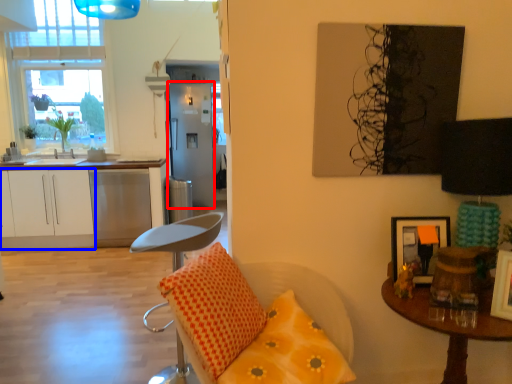
Question: Which point is closer to the camera, fridge (highlighted by a red box) or cabinetry (highlighted by a blue box)?

Choices:
 (A) fridge
 (B) cabinetry

Answer: (B)